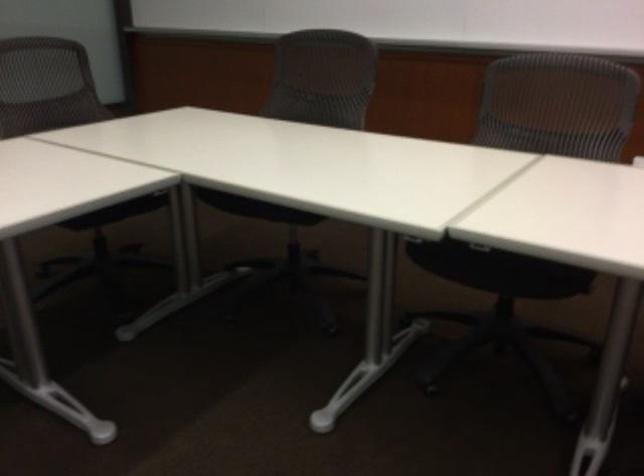
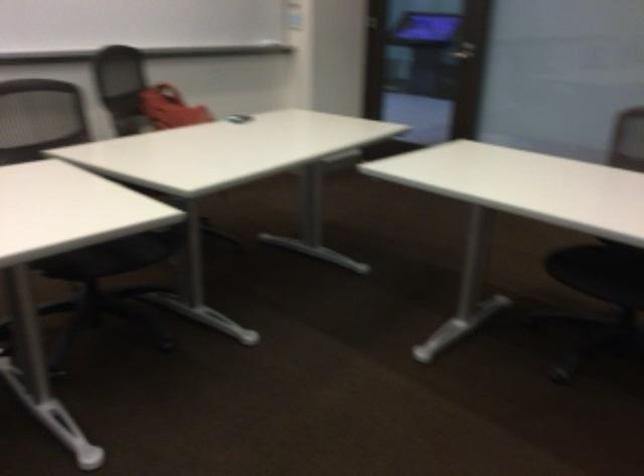
The first image is from the beginning of the video and the second image is from the end. How did the camera likely rotate when shooting the video?

The rotation direction of the camera is left-down.